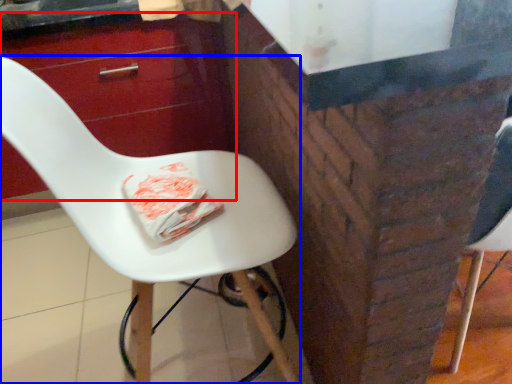
Question: Which object is further to the camera taking this photo, drawer (highlighted by a red box) or chair (highlighted by a blue box)?

Choices:
 (A) drawer
 (B) chair

Answer: (A)